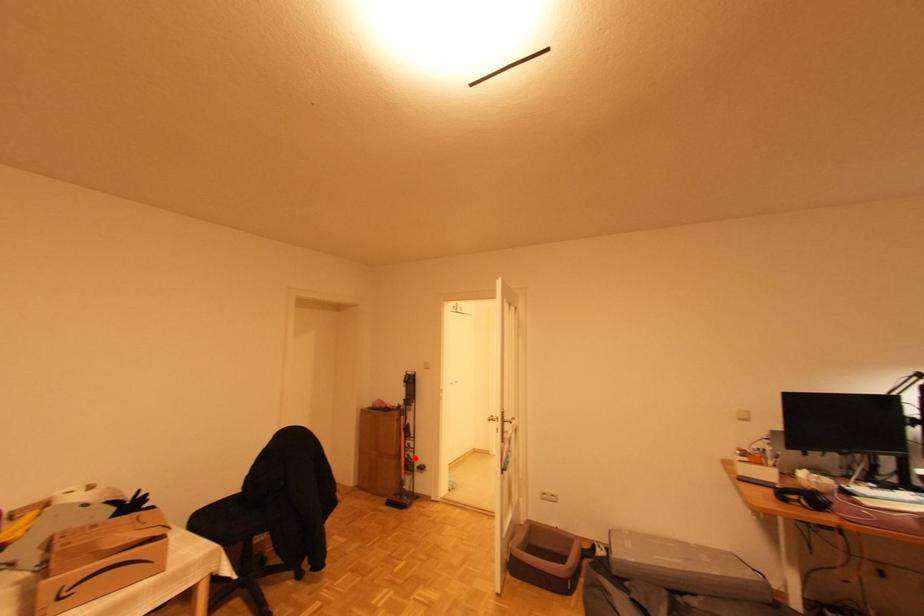
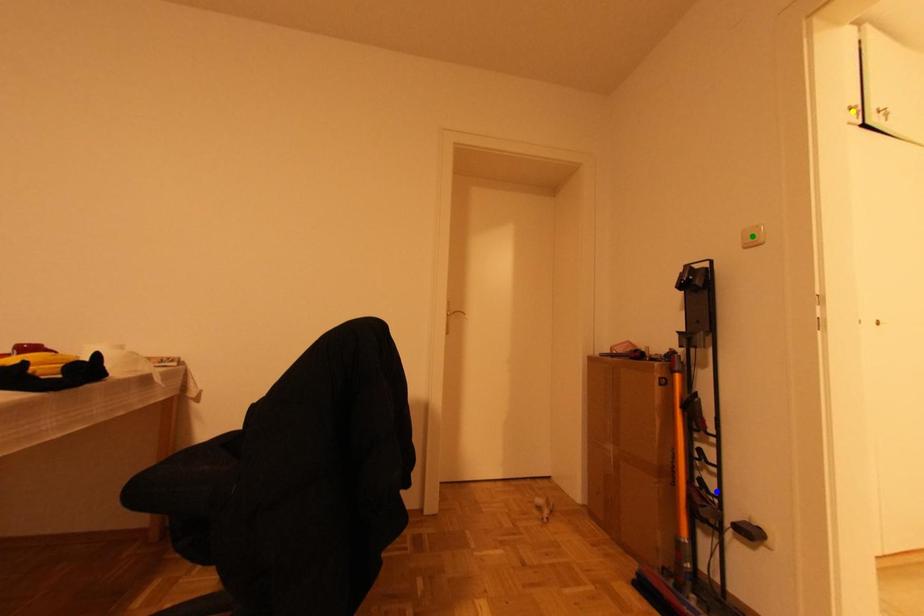
Question: I am providing you with two images of the same scene from different viewpoints. A red point is marked on the first image. You are given multiple points on the second image. In image 2, which mark is for the same physical point as the one in image 1?

Choices:
 (A) yellow point
 (B) blue point
 (C) green point

Answer: (B)